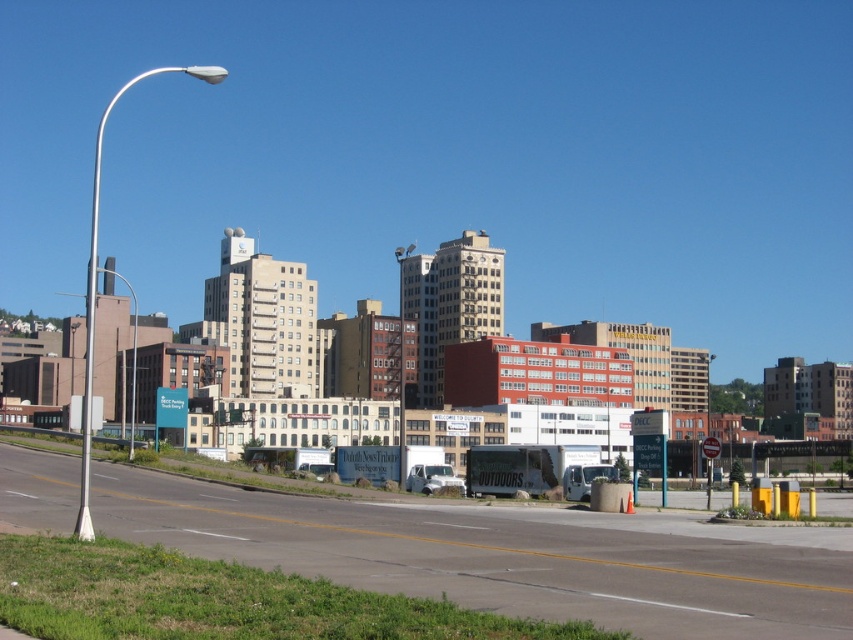
You are a pedestrian standing on the grassy median strip at the left side of the road. You notice two poles on your left side. Which pole, the white metallic pole at left or the metallic gray pole at left, is closer to you?

The white metallic pole at left is closer to you because it is in front of the metallic gray pole at left.

You are a city planner reviewing the layout of the cityscape. You notice two poles on the left side of the road. Which pole, the white metallic pole at left or the metallic gray pole at left, is taller?

The white metallic pole at left is much taller than the metallic gray pole at left.